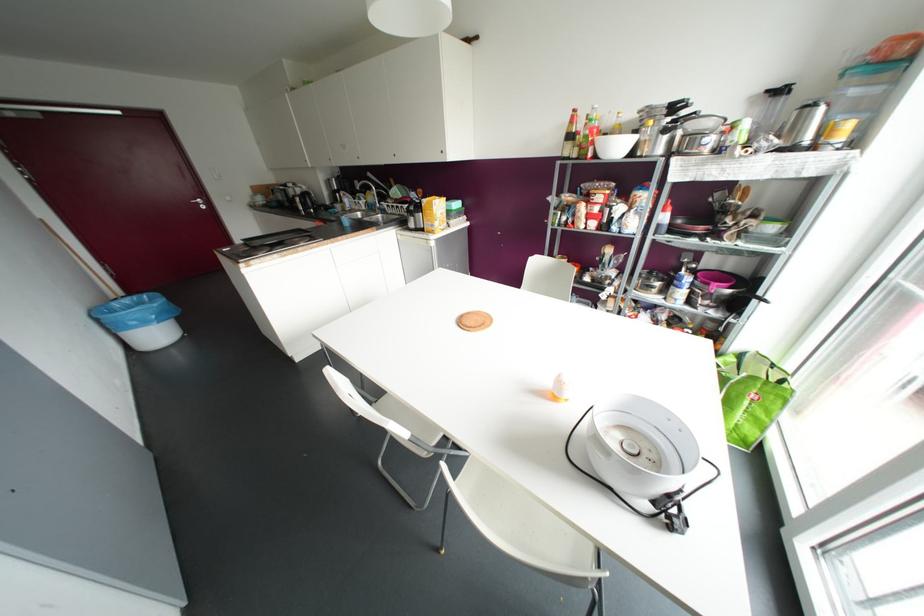
Which object does [433,214] point to?

It corresponds to the yellow food box in the image.